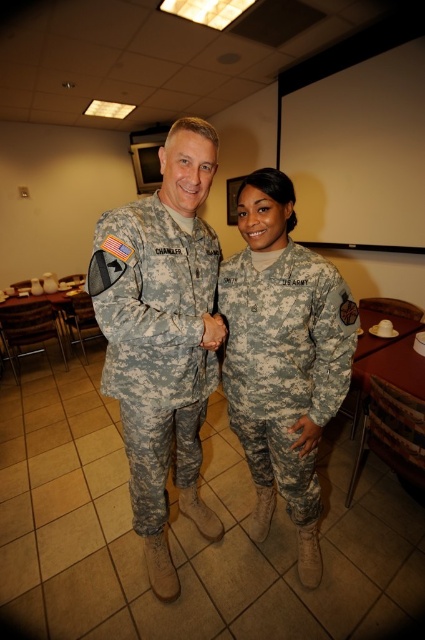
You are standing in the room and want to point to the exact location of point (283, 356). Which object in the scene does this point lie on?

The point (283, 356) lies on the camouflage uniform at center.